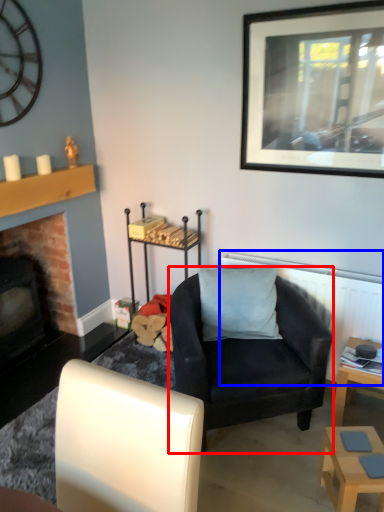
Question: Which object appears closest to the camera in this image, chair (highlighted by a red box) or radiator (highlighted by a blue box)?

Choices:
 (A) chair
 (B) radiator

Answer: (A)